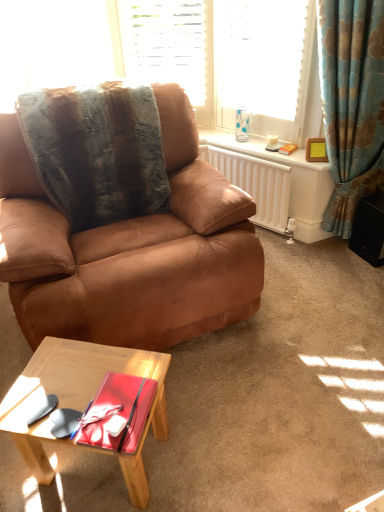
Where is `vacant space situated above light wood coffee table at lower left (from a real-world perspective)`? The width and height of the screenshot is (384, 512). vacant space situated above light wood coffee table at lower left (from a real-world perspective) is located at coordinates (91, 380).